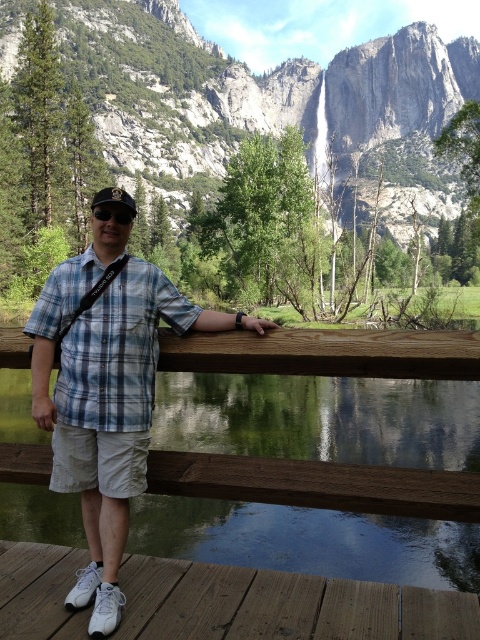
You are a photographer at the scenic spot. You want to take a photo of the waterfall in the background. There is a point at coordinates point (106, 392). Where is this point located on the scene?

The point (106, 392) is located on the plaid cotton shirt at center.

Looking at this image, you are standing at the edge of the brown wooden deck at lower center. Looking towards the waterfall, what is the direction of the waterfall relative to your position?

The waterfall is located behind the brown wooden deck at lower center, so it is directly behind you when standing on the deck.

You are a hiker who wants to take a photo of the waterfall from the deck. You have the black matte goggles at center and the brown wooden deck at lower center in your view. Which object is closer to the waterfall?

The black matte goggles at center are closer to the waterfall because the brown wooden deck at lower center is located below them, meaning the goggles are positioned higher up towards the waterfall.